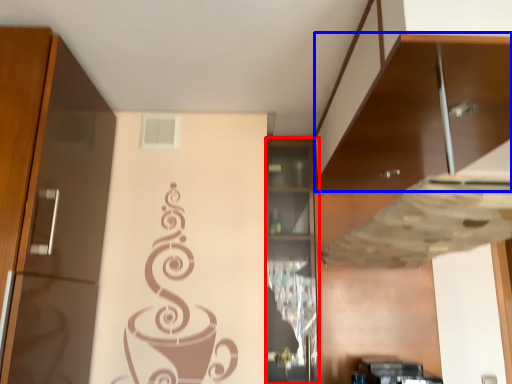
Question: Which object appears closest to the camera in this image, cabinetry (highlighted by a red box) or cabinetry (highlighted by a blue box)?

Choices:
 (A) cabinetry
 (B) cabinetry

Answer: (B)